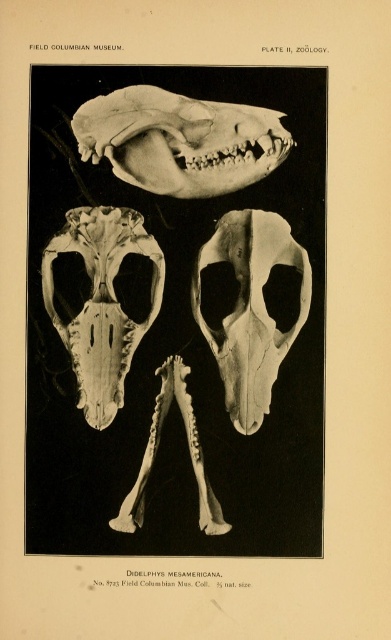
Question: Which of the following is the farthest from the observer?

Choices:
 (A) translucent bone skull at center
 (B) white bone skull at center
 (C) translucent bone skull at upper center

Answer: (B)

Question: Which of the following is the farthest from the observer?

Choices:
 (A) (125, 364)
 (B) (242, 346)
 (C) (193, 140)

Answer: (B)

Question: Considering the real-world distances, which object is farthest from the translucent bone skull at upper center?

Choices:
 (A) white bone skull at center
 (B) translucent bone skull at center

Answer: (B)

Question: Does translucent bone skull at upper center appear under white bone skull at center?

Choices:
 (A) yes
 (B) no

Answer: (B)

Question: Is white bone skull at center positioned at the back of translucent bone skull at center?

Choices:
 (A) no
 (B) yes

Answer: (B)

Question: Does translucent bone skull at upper center appear on the right side of white bone skull at center?

Choices:
 (A) no
 (B) yes

Answer: (A)